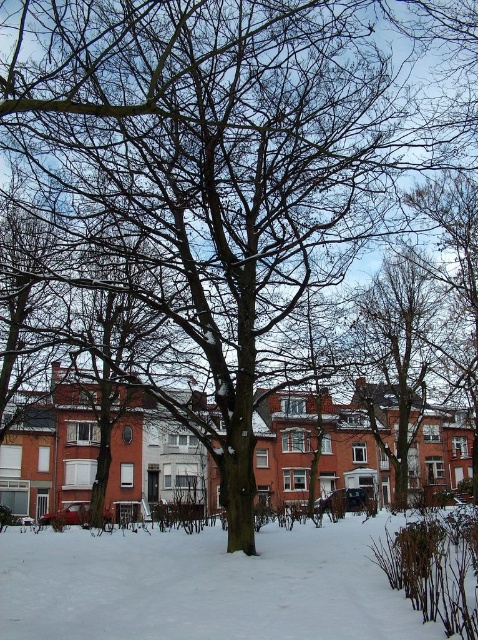
Question: Which point appears closest to the camera in this image?

Choices:
 (A) (408, 634)
 (B) (417, 406)

Answer: (A)

Question: Can you confirm if white powdery snow at lower center is smaller than bare branches at upper center?

Choices:
 (A) no
 (B) yes

Answer: (B)

Question: In this image, where is white powdery snow at lower center located relative to bare branches at upper center?

Choices:
 (A) right
 (B) left

Answer: (B)

Question: Can you confirm if white powdery snow at lower center is positioned above bare branches at upper center?

Choices:
 (A) yes
 (B) no

Answer: (A)

Question: Which point is closer to the camera?

Choices:
 (A) white powdery snow at lower center
 (B) bare branches at upper center

Answer: (A)